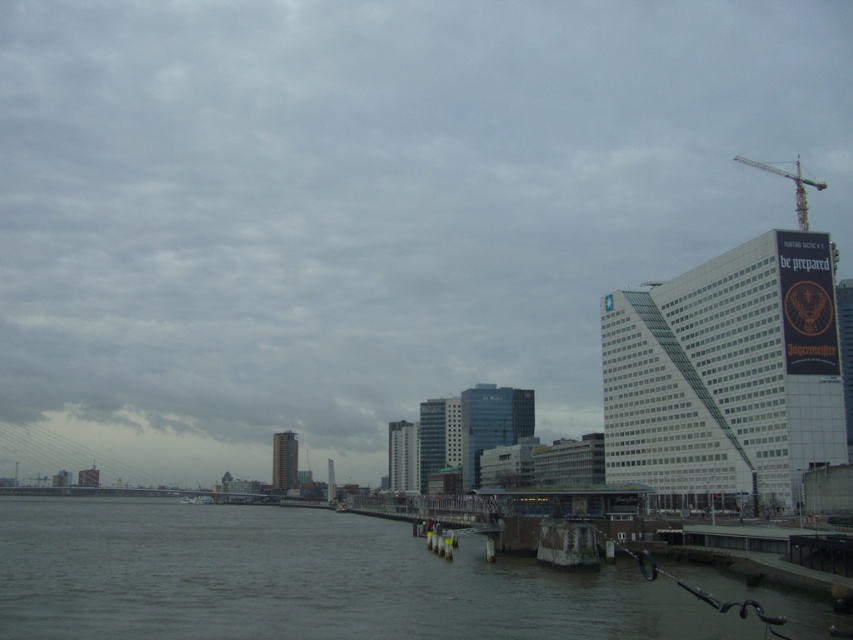
Can you confirm if gray concrete water at lower left is smaller than metallic yellow crane at upper right?

Indeed, gray concrete water at lower left has a smaller size compared to metallic yellow crane at upper right.

Between gray concrete water at lower left and metallic yellow crane at upper right, which one appears on the left side from the viewer's perspective?

Positioned to the left is gray concrete water at lower left.

The width and height of the screenshot is (853, 640). What do you see at coordinates (305, 580) in the screenshot? I see `gray concrete water at lower left` at bounding box center [305, 580].

Locate an element on the screen. The height and width of the screenshot is (640, 853). gray concrete water at lower left is located at coordinates (305, 580).